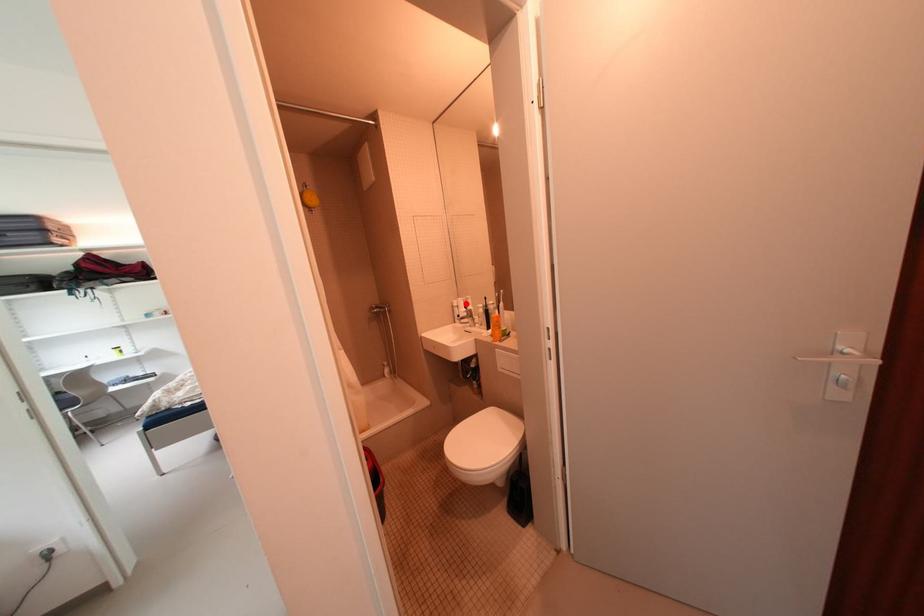
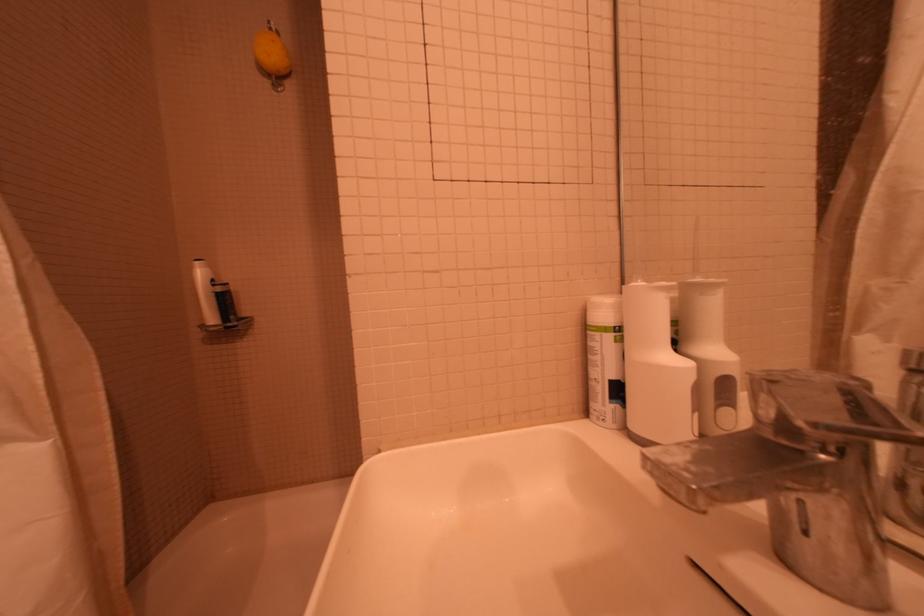
Where in the second image is the point corresponding to the highlighted location from the first image?

(627, 309)